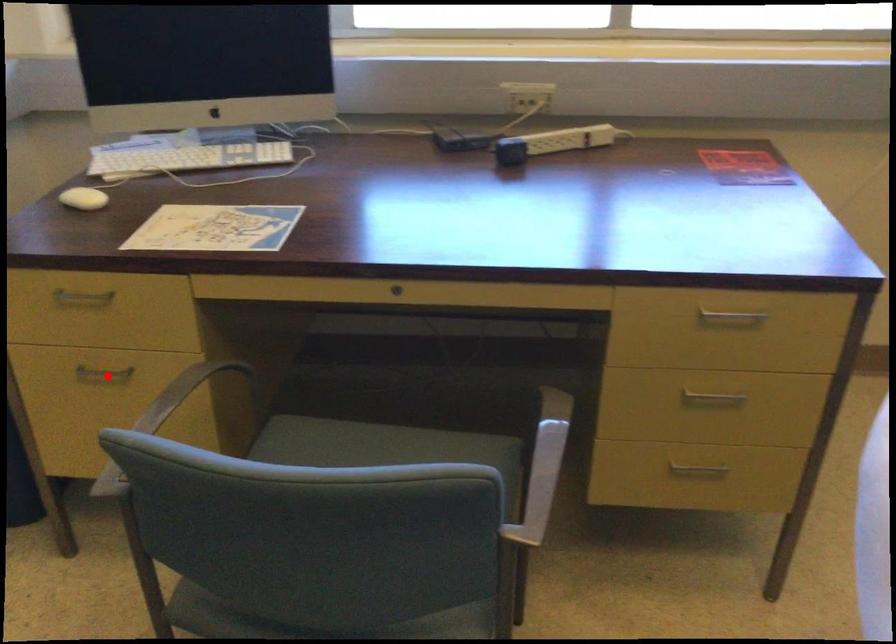
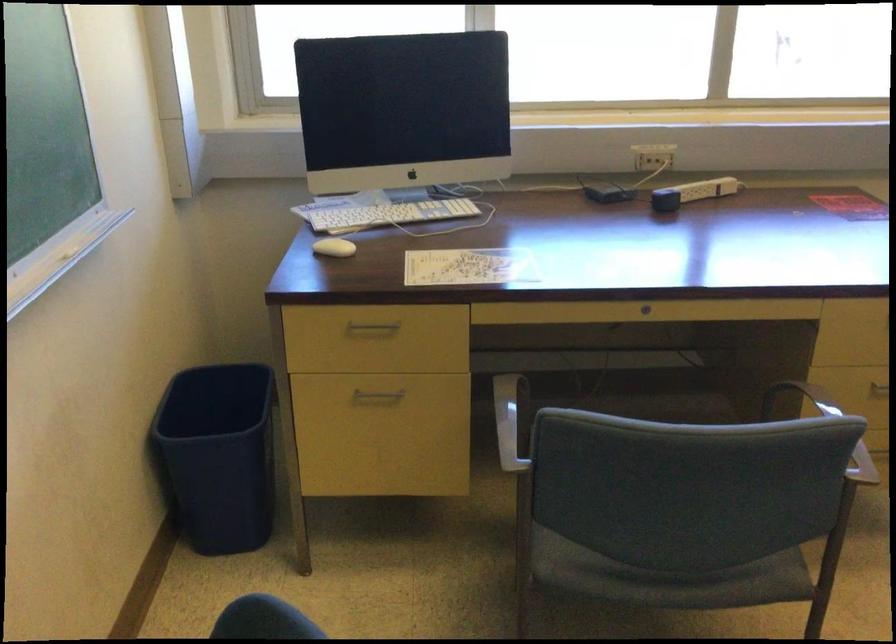
Question: I am providing you with two images of the same scene from different viewpoints. In image1, a red point is highlighted. Considering the same 3D point in image2, which of the following is correct?

Choices:
 (A) It is closer
 (B) It is farther

Answer: (B)